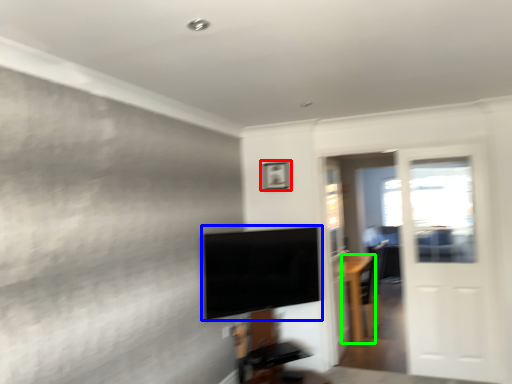
Question: Estimate the real-world distances between objects in this image. Which object is farther from picture frame (highlighted by a red box), television (highlighted by a blue box) or furniture (highlighted by a green box)?

Choices:
 (A) television
 (B) furniture

Answer: (B)